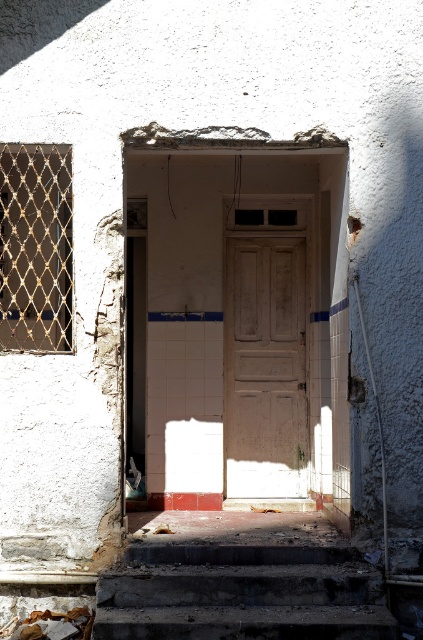
Can you confirm if dark concrete stairs at lower center is smaller than rusty metal debris at lower left?

Incorrect, dark concrete stairs at lower center is not smaller in size than rusty metal debris at lower left.

What are the coordinates of `dark concrete stairs at lower center` in the screenshot? It's located at (241, 593).

Does white matte door at center appear over rusty metal debris at lower left?

Correct, white matte door at center is located above rusty metal debris at lower left.

Who is positioned more to the right, white matte door at center or rusty metal debris at lower left?

Positioned to the right is white matte door at center.

Between point (288, 337) and point (32, 621), which one is positioned behind?

Point (288, 337)

This screenshot has width=423, height=640. Identify the location of white matte door at center. (264, 369).

Is dark concrete stairs at lower center in front of white matte door at center?

Yes.

Can you confirm if dark concrete stairs at lower center is positioned to the left of white matte door at center?

Correct, you'll find dark concrete stairs at lower center to the left of white matte door at center.

The width and height of the screenshot is (423, 640). Identify the location of dark concrete stairs at lower center. (241, 593).